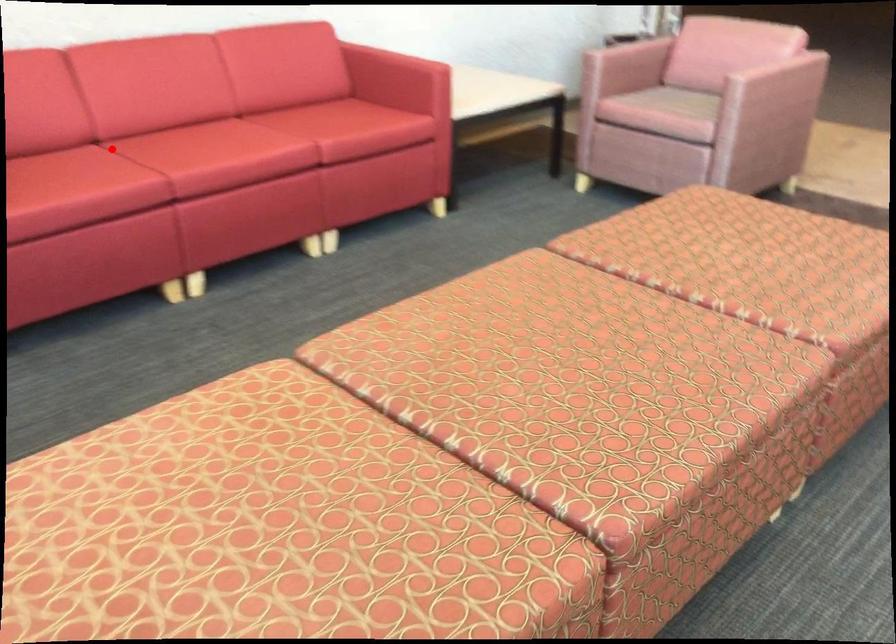
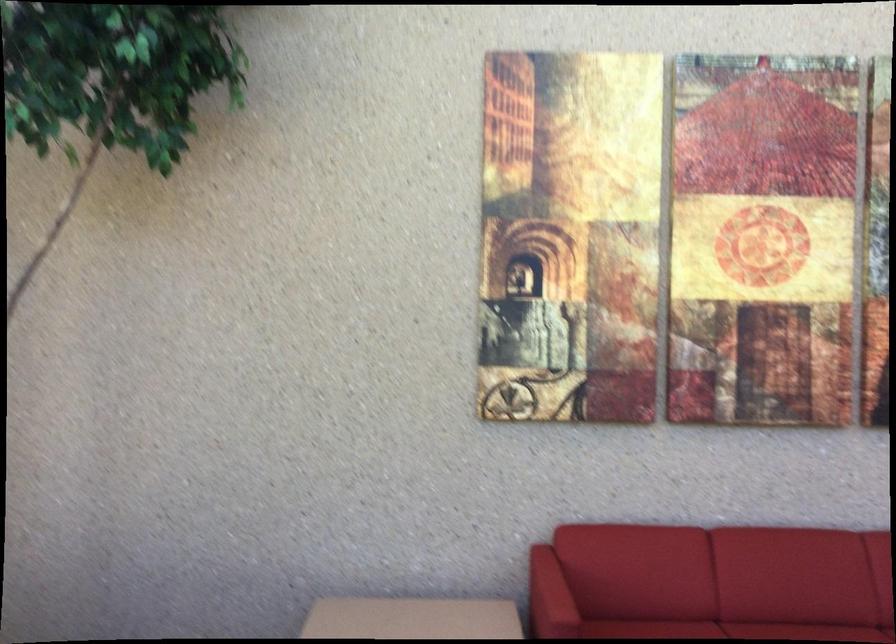
Where in the second image is the point corresponding to the highlighted location from the first image?

(727, 630)